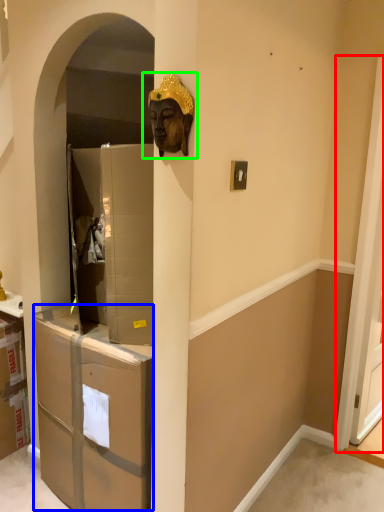
Question: Which object is positioned farthest from screen door (highlighted by a red box)? Select from drawer (highlighted by a blue box) and bronze statue (highlighted by a green box).

Choices:
 (A) drawer
 (B) bronze statue

Answer: (B)